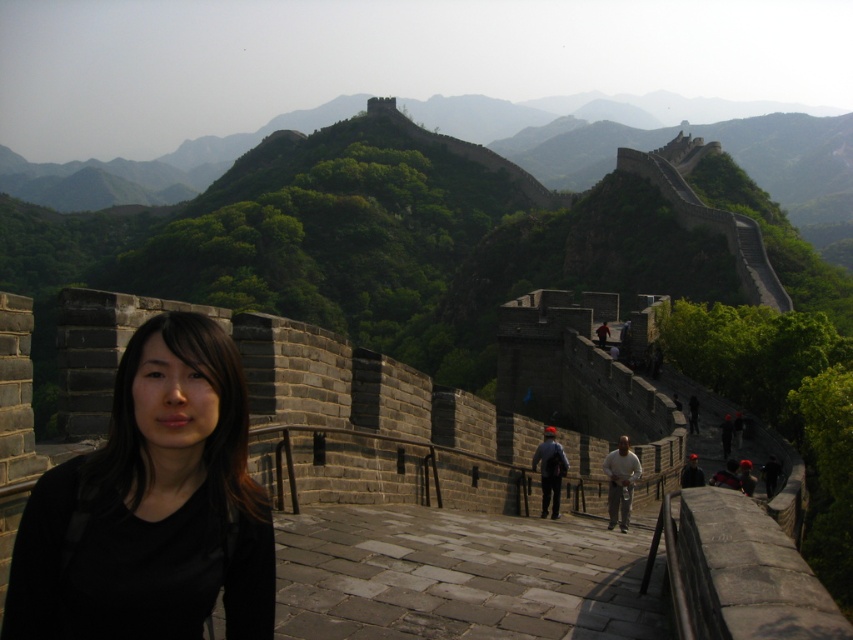
You are a tour guide leading a group on the Great Wall. You notice two visitors wearing a black matte shirt at center and a light brown leather jacket at center. If your group is 1.5 meters wide, can they safely pass between these two visitors without squeezing?

The distance between the black matte shirt at center and the light brown leather jacket at center is 28.32 meters. Since your group is only 1.5 meters wide, there is ample space for them to pass safely between the two visitors without any need to squeeze.

Based on the photo, you are a photographer planning to capture a group photo of the two people on the Great Wall. The camera you are using has a maximum width of 1.2 meters for the frame. Given the black matte shirt at center and the light brown leather jacket at center, can both people fit within the camera frame if they stand side by side?

The black matte shirt at center might be wider than light brown leather jacket at center, so the total width of both individuals could exceed the camera frame of 1.2 meters. It is uncertain if they will fit without knowing the exact width of each person.